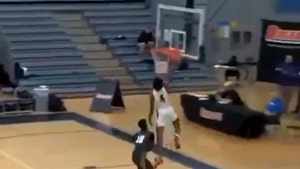
Where is `black table`? The height and width of the screenshot is (169, 300). black table is located at coordinates (236, 115).